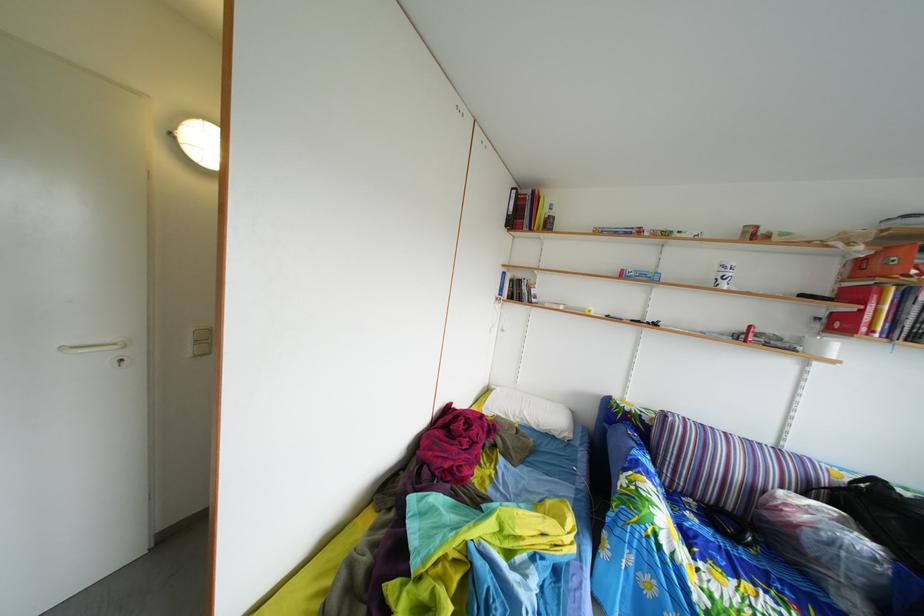
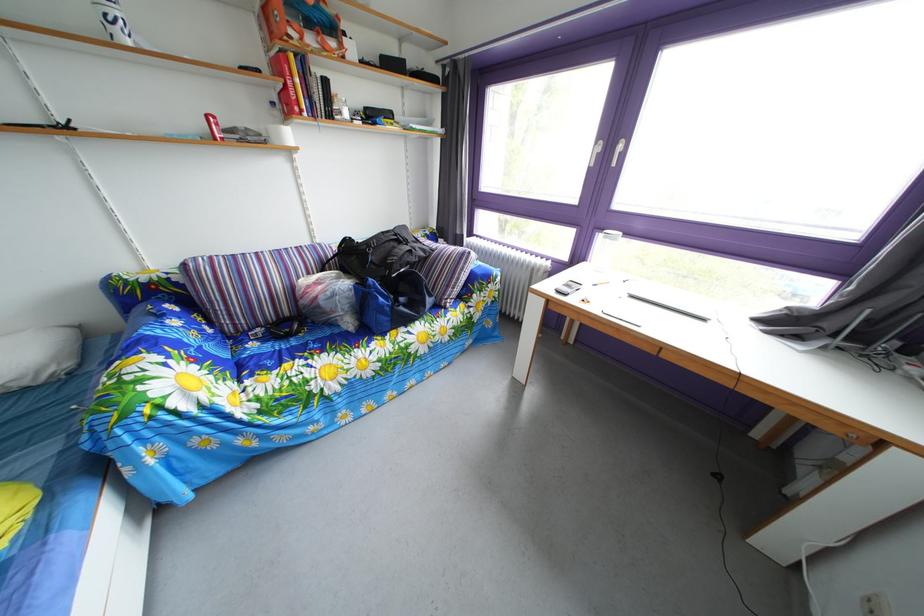
The point at [829,328] is marked in the first image. Where is the corresponding point in the second image?

(284, 111)